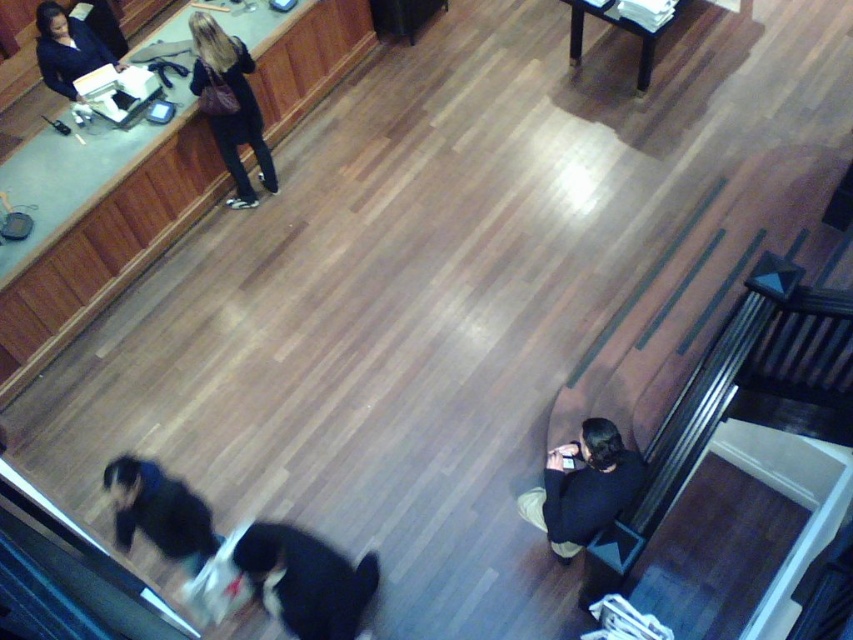
Which is behind, point (207, 524) or point (68, 48)?

The point (68, 48) is more distant.

How far apart are dark blue jacket at lower left and matte black jacket at upper left?

dark blue jacket at lower left and matte black jacket at upper left are 2.80 meters apart.

Where is `dark blue jacket at lower left`? The height and width of the screenshot is (640, 853). dark blue jacket at lower left is located at coordinates (160, 512).

Is black fur dog at lower center bigger than black soft fabric at lower right?

Yes.

Who is positioned more to the left, black fur dog at lower center or black soft fabric at lower right?

From the viewer's perspective, black fur dog at lower center appears more on the left side.

Between point (310, 554) and point (589, 477), which one is positioned behind?

Positioned behind is point (310, 554).

This screenshot has height=640, width=853. What are the coordinates of `black fur dog at lower center` in the screenshot? It's located at (305, 579).

Does black soft fabric at lower right appear over dark blue jeans at upper center?

Incorrect, black soft fabric at lower right is not positioned above dark blue jeans at upper center.

Is point (579, 440) more distant than point (209, 22)?

No.

You are a GUI agent. You are given a task and a screenshot of the screen. Output one action in this format:
    pyautogui.click(x=<x>, y=<y>)
    Task: Click on the black soft fabric at lower right
    
    Given the screenshot: What is the action you would take?
    pyautogui.click(x=582, y=486)